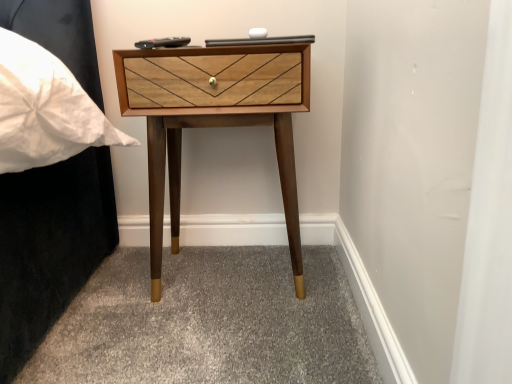
Identify the location of wooden nightstand at center. (213, 119).

Describe the element at coordinates (213, 119) in the screenshot. The height and width of the screenshot is (384, 512). I see `wooden nightstand at center` at that location.

In order to click on wooden nightstand at center in this screenshot , I will do `click(213, 119)`.